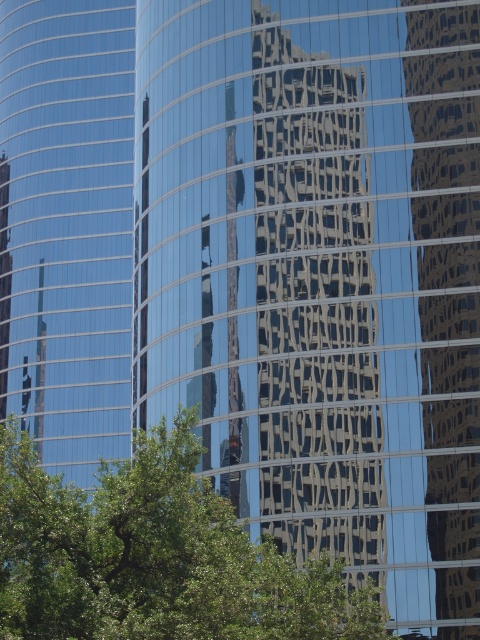
Based on the photo, which of these two, green leafy tree at center or glossy glass building at center, stands taller?

glossy glass building at center is taller.

What do you see at coordinates (154, 556) in the screenshot? I see `green leafy tree at center` at bounding box center [154, 556].

Between point (88, 545) and point (456, 26), which one is positioned in front?

Point (88, 545)

You are a GUI agent. You are given a task and a screenshot of the screen. Output one action in this format:
    pyautogui.click(x=<x>, y=<y>)
    Task: Click on the green leafy tree at center
    
    Given the screenshot: What is the action you would take?
    pyautogui.click(x=154, y=556)